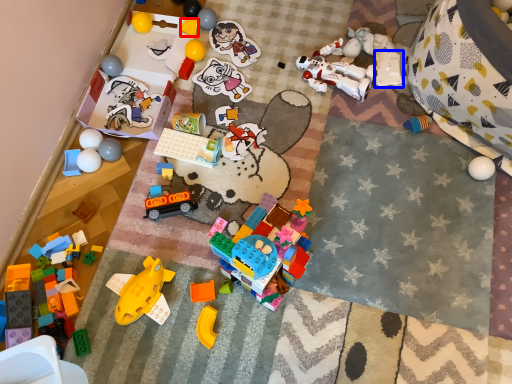
Question: Which point is further to the camera, toy (highlighted by a red box) or toy (highlighted by a blue box)?

Choices:
 (A) toy
 (B) toy

Answer: (A)